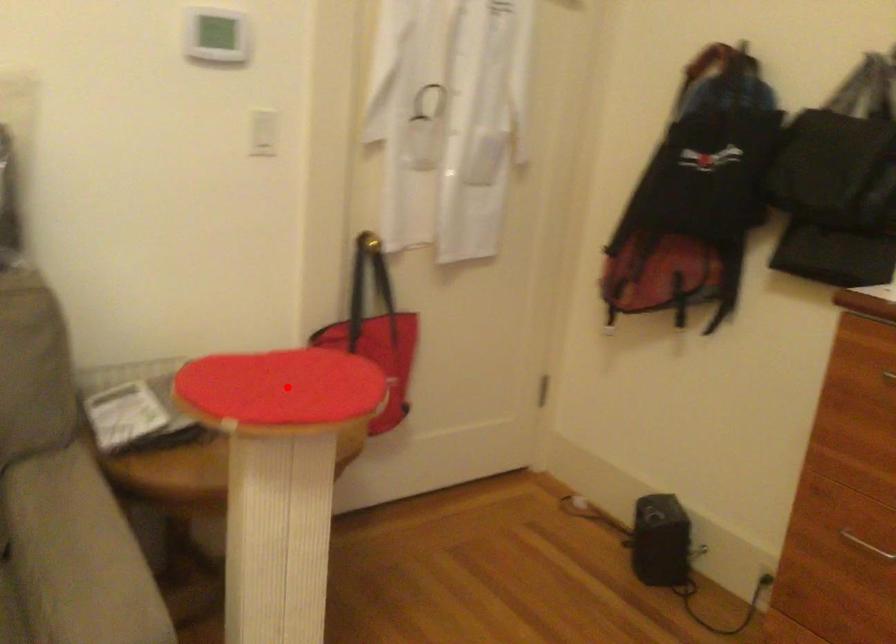
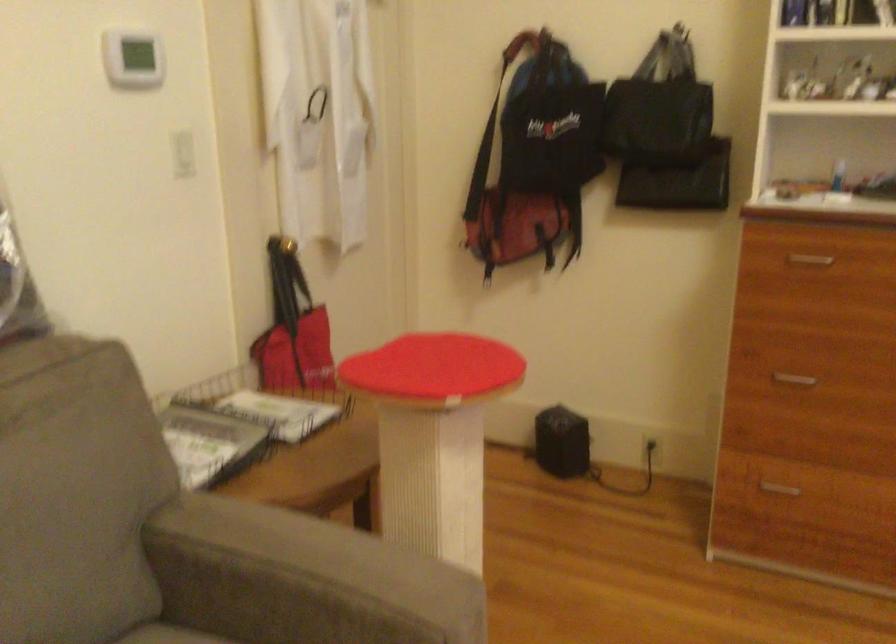
Question: I am providing you with two images of the same scene from different viewpoints. A red point is shown in image1. For the corresponding object point in image2, is it positioned nearer or farther from the camera?

Choices:
 (A) Nearer
 (B) Farther

Answer: (B)